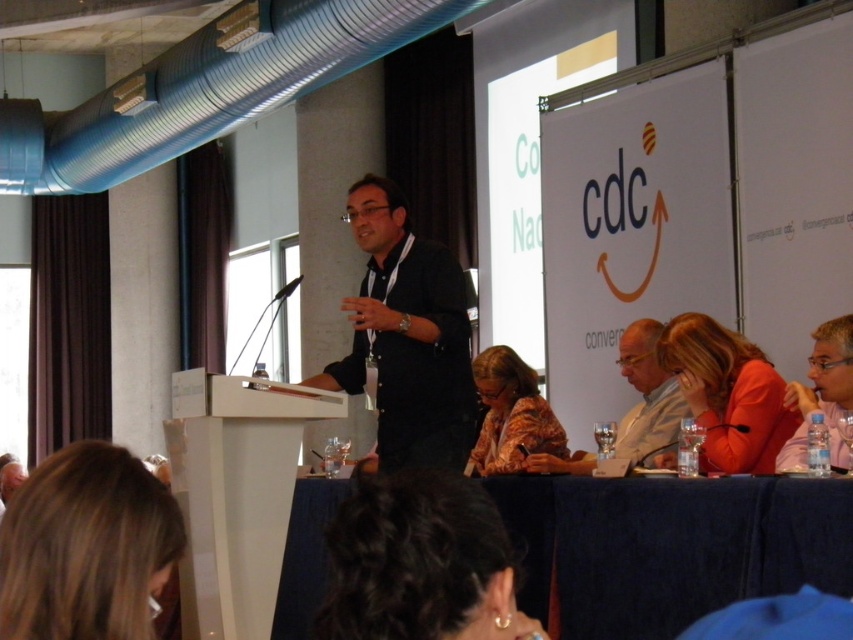
Who is higher up, blonde hair at lower left or matte black laptop at right?

matte black laptop at right

Who is taller, blonde hair at lower left or matte black laptop at right?

With more height is matte black laptop at right.

What do you see at coordinates (86, 547) in the screenshot? I see `blonde hair at lower left` at bounding box center [86, 547].

The image size is (853, 640). Find the location of `blonde hair at lower left`. blonde hair at lower left is located at coordinates coord(86,547).

Does point (4, 628) come closer to viewer compared to point (646, 426)?

Yes, it is in front of point (646, 426).

Can you confirm if blonde hair at lower left is shorter than matte black shirt at center?

Yes, blonde hair at lower left is shorter than matte black shirt at center.

Between point (106, 557) and point (653, 449), which one is positioned in front?

Point (106, 557)

What are the coordinates of `blonde hair at lower left` in the screenshot? It's located at (86, 547).

Which is above, orange fabric jacket at lower right or matte black laptop at right?

orange fabric jacket at lower right

Is orange fabric jacket at lower right to the left of matte black laptop at right from the viewer's perspective?

Yes, orange fabric jacket at lower right is to the left of matte black laptop at right.

Describe the element at coordinates (727, 394) in the screenshot. The height and width of the screenshot is (640, 853). I see `orange fabric jacket at lower right` at that location.

Locate an element on the screen. The image size is (853, 640). orange fabric jacket at lower right is located at coordinates (727, 394).